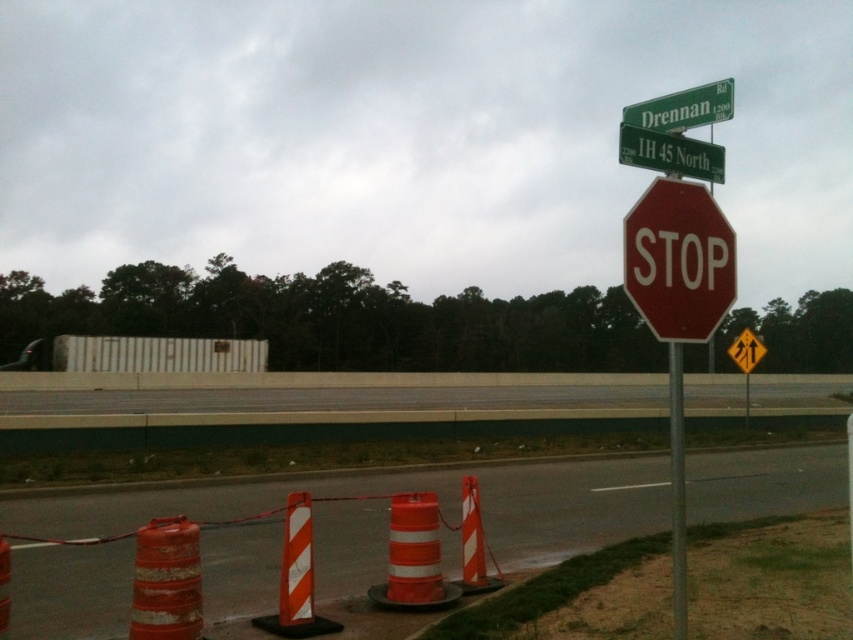
Is orange reflective cones at lower center closer to camera compared to green metallic street sign at upper center?

No, it is not.

Does orange reflective cones at lower center have a greater width compared to green metallic street sign at upper center?

Correct, the width of orange reflective cones at lower center exceeds that of green metallic street sign at upper center.

Which is in front, point (320, 506) or point (680, 144)?

Point (680, 144) is in front.

The image size is (853, 640). I want to click on orange reflective cones at lower center, so click(x=413, y=490).

Is green metallic street sign at upper center positioned in front of metallic pole at center?

No, it is not.

Based on the photo, between green metallic street sign at upper center and metallic pole at center, which one has less height?

With less height is green metallic street sign at upper center.

Find the location of a particular element. Image resolution: width=853 pixels, height=640 pixels. green metallic street sign at upper center is located at coordinates (670, 154).

Can you confirm if orange reflective cones at lower center is shorter than orange reflective cone at lower center?

In fact, orange reflective cones at lower center may be taller than orange reflective cone at lower center.

Who is taller, orange reflective cones at lower center or orange reflective cone at lower center?

With more height is orange reflective cones at lower center.

Locate an element on the screen. The width and height of the screenshot is (853, 640). orange reflective cones at lower center is located at coordinates (413, 490).